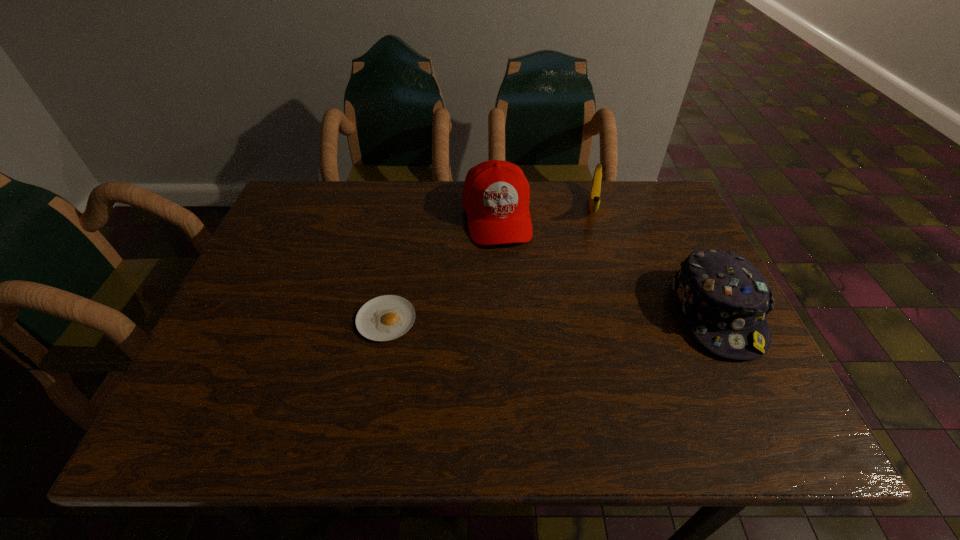
Find the location of a particular element. The width and height of the screenshot is (960, 540). free space on the desktop that is between the shortest object and the third shortest object and is positioned on the front panel of the tallest object is located at coordinates (516, 317).

Find the location of a particular element. free spot on the desktop that is between the shortest object and the headwear and is positioned at the stem of the second shortest object is located at coordinates (583, 316).